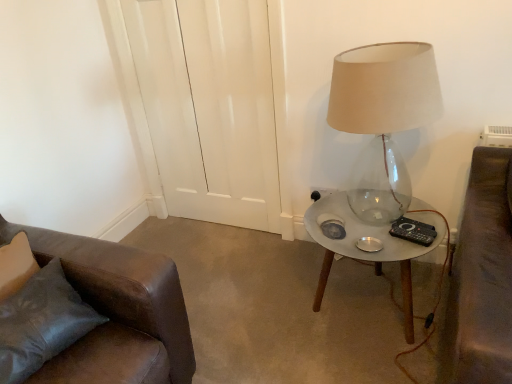
Question: Does metallic glass table at right have a greater height compared to translucent glass lamp at right?

Choices:
 (A) yes
 (B) no

Answer: (B)

Question: Does metallic glass table at right touch translucent glass lamp at right?

Choices:
 (A) no
 (B) yes

Answer: (A)

Question: From the image's perspective, is metallic glass table at right below translucent glass lamp at right?

Choices:
 (A) yes
 (B) no

Answer: (A)

Question: Is metallic glass table at right oriented away from translucent glass lamp at right?

Choices:
 (A) no
 (B) yes

Answer: (A)

Question: Can you confirm if metallic glass table at right is shorter than translucent glass lamp at right?

Choices:
 (A) yes
 (B) no

Answer: (A)

Question: In terms of height, does metallic glass table at right look taller or shorter compared to black plastic remote control at right?

Choices:
 (A) short
 (B) tall

Answer: (B)

Question: Is point (395, 254) positioned closer to the camera than point (415, 238)?

Choices:
 (A) farther
 (B) closer

Answer: (B)

Question: Considering their positions, is metallic glass table at right located in front of or behind black plastic remote control at right?

Choices:
 (A) front
 (B) behind

Answer: (A)

Question: Is metallic glass table at right inside the boundaries of black plastic remote control at right, or outside?

Choices:
 (A) outside
 (B) inside

Answer: (A)

Question: Considering the positions of black plastic remote control at right and black plastic socket at lower right in the image, is black plastic remote control at right bigger or smaller than black plastic socket at lower right?

Choices:
 (A) small
 (B) big

Answer: (B)

Question: Considering the positions of black plastic remote control at right and black plastic socket at lower right in the image, is black plastic remote control at right wider or thinner than black plastic socket at lower right?

Choices:
 (A) wide
 (B) thin

Answer: (A)

Question: From their relative heights in the image, would you say black plastic remote control at right is taller or shorter than black plastic socket at lower right?

Choices:
 (A) tall
 (B) short

Answer: (B)

Question: From the image's perspective, is black plastic remote control at right above or below black plastic socket at lower right?

Choices:
 (A) above
 (B) below

Answer: (B)

Question: Considering the relative positions of translucent glass lamp at right and leather couch at lower left in the image provided, is translucent glass lamp at right to the left or to the right of leather couch at lower left?

Choices:
 (A) left
 (B) right

Answer: (B)

Question: Is translucent glass lamp at right wider or thinner than leather couch at lower left?

Choices:
 (A) wide
 (B) thin

Answer: (A)